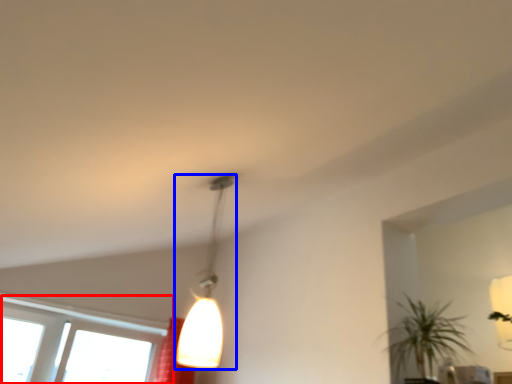
Question: Which object appears farthest to the camera in this image, window (highlighted by a red box) or lamp (highlighted by a blue box)?

Choices:
 (A) window
 (B) lamp

Answer: (A)